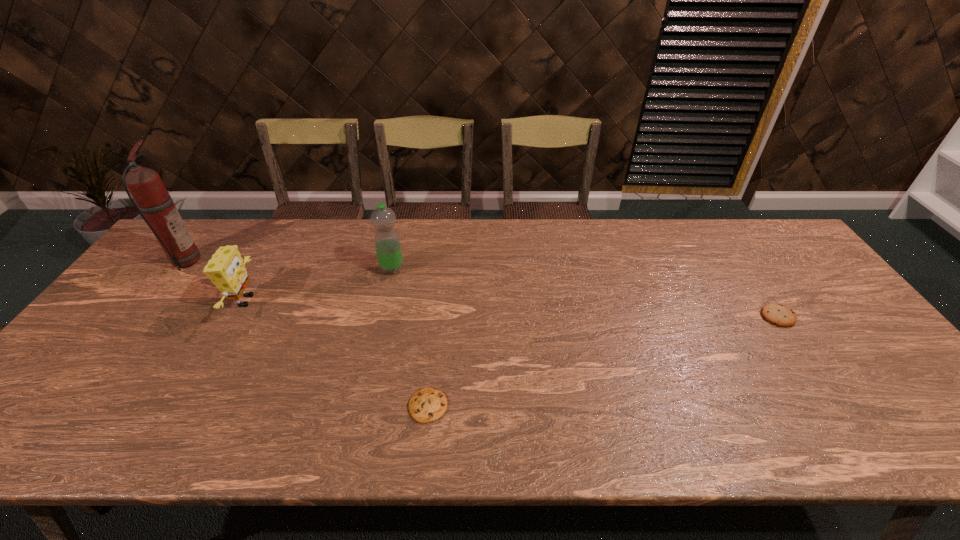
Where is `the tallest object`? The image size is (960, 540). the tallest object is located at coordinates (152, 200).

At what (x,y) coordinates should I click in order to perform the action: click on the leftmost object. Please return your answer as a coordinate pair (x, y). The image size is (960, 540). Looking at the image, I should click on (152, 200).

Identify the location of water bottle. The width and height of the screenshot is (960, 540). (387, 243).

The image size is (960, 540). In order to click on the third object from left to right in this screenshot , I will do `click(387, 243)`.

You are a GUI agent. You are given a task and a screenshot of the screen. Output one action in this format:
    pyautogui.click(x=<x>, y=<y>)
    Task: Click on the third tallest object
    The width and height of the screenshot is (960, 540).
    Given the screenshot: What is the action you would take?
    pyautogui.click(x=226, y=269)

Locate an element on the screen. sponge is located at coordinates (226, 269).

Find the location of a particular element. Image resolution: width=960 pixels, height=540 pixels. the rightmost object is located at coordinates (780, 315).

Where is `the farther cookie`? the farther cookie is located at coordinates (780, 315).

The image size is (960, 540). In order to click on the nearest object in this screenshot , I will do `click(426, 405)`.

The image size is (960, 540). Identify the location of the shorter cookie. (426, 405).